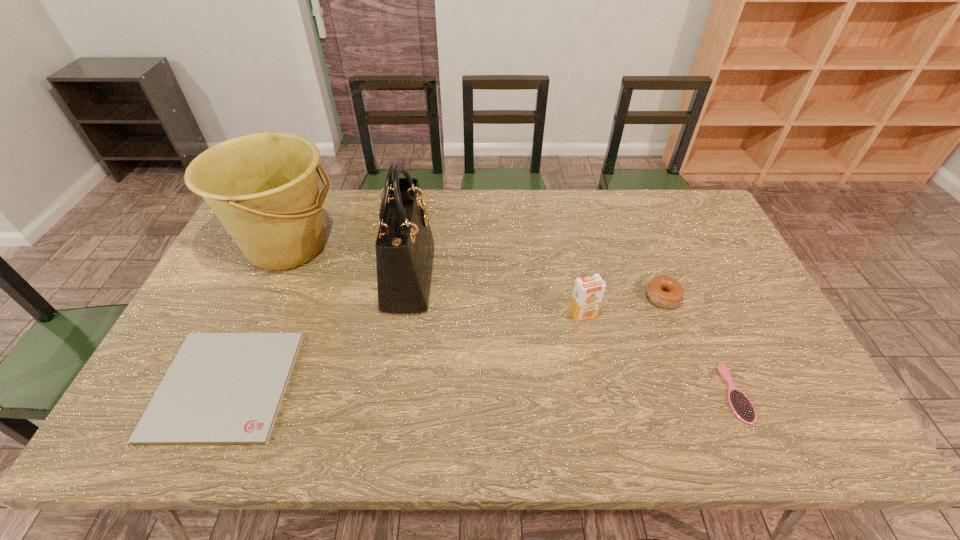
At what (x,y) coordinates should I click in order to perform the action: click on free spot located 0.120m at the front of the tallest object with visible charms. Please return your answer as a coordinate pair (x, y). The image size is (960, 540). Looking at the image, I should click on (472, 278).

Where is `free spot located 0.240m on the side of the bucket with the handle`? This screenshot has height=540, width=960. free spot located 0.240m on the side of the bucket with the handle is located at coordinates (416, 246).

What are the coordinates of `vacant space positioned 0.330m on the left of the fourth shortest object` in the screenshot? It's located at (451, 314).

You are a GUI agent. You are given a task and a screenshot of the screen. Output one action in this format:
    pyautogui.click(x=<x>, y=<y>)
    Task: Click on the free space located on the front of the bagel
    
    Given the screenshot: What is the action you would take?
    pyautogui.click(x=691, y=373)

Locate an element on the screen. free location located 0.280m on the left of the hairbrush is located at coordinates (608, 393).

Find the location of a particular element. The image size is (960, 540). vacant space situated 0.280m on the back of the shortest object is located at coordinates (280, 263).

Find the location of a particular element. object present at the far edge is located at coordinates (263, 187).

Locate an element on the screen. This screenshot has width=960, height=540. hairbrush at the near edge is located at coordinates (740, 404).

Find the location of a particular element. clipboard located in the near edge section of the desktop is located at coordinates (222, 388).

At what (x,y) coordinates should I click in order to perform the action: click on bucket that is at the left edge. Please return your answer as a coordinate pair (x, y). The image size is (960, 540). Looking at the image, I should click on (263, 187).